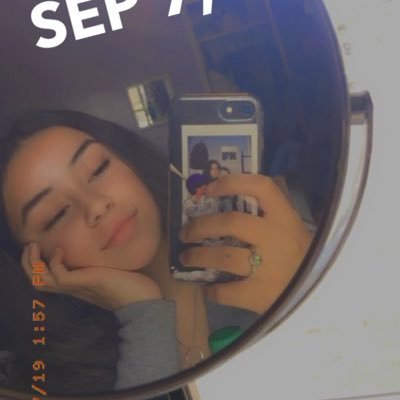
Where is `mirror`? This screenshot has height=400, width=400. mirror is located at coordinates (234, 356).